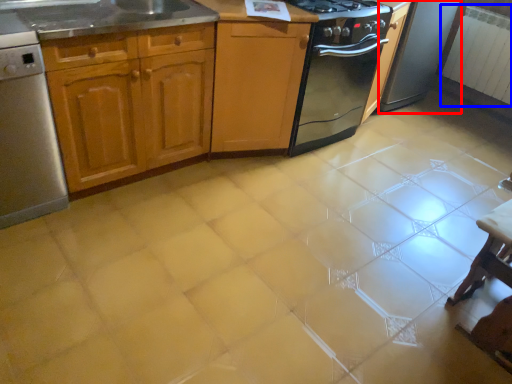
Question: Which object is closer to the camera taking this photo, appliance (highlighted by a red box) or radiator (highlighted by a blue box)?

Choices:
 (A) appliance
 (B) radiator

Answer: (A)